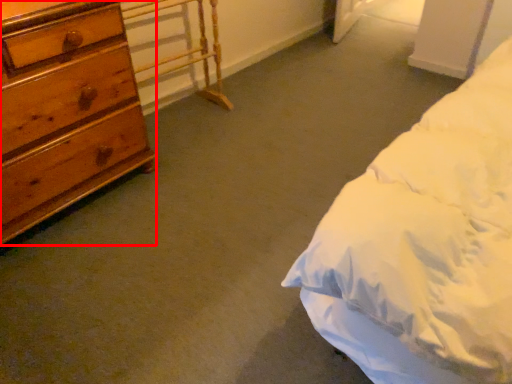
Question: From the image's perspective, what is the correct spatial positioning of chest of drawers (annotated by the red box) in reference to table?

Choices:
 (A) above
 (B) below

Answer: (B)